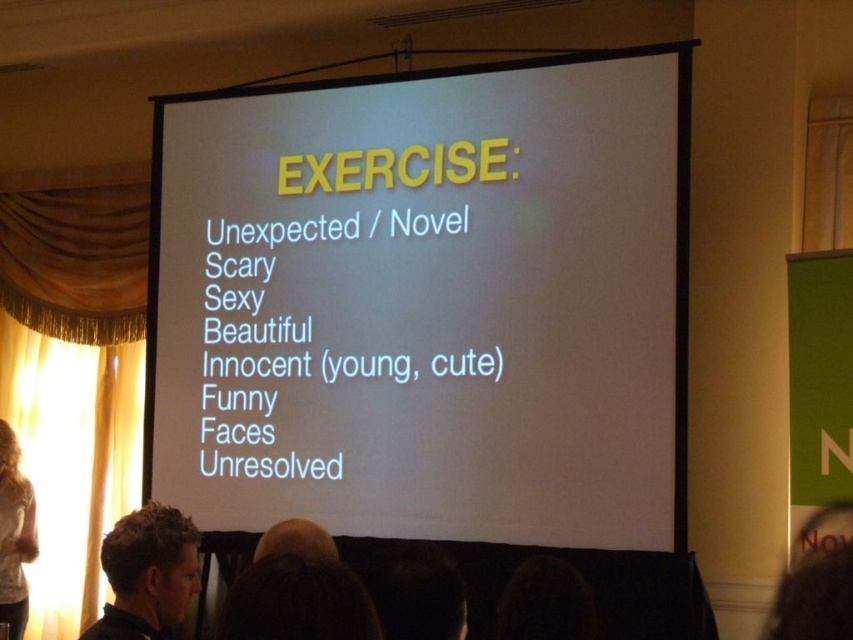
Question: Can you confirm if white matte projection screen at center is positioned above dark brown hair at lower left?

Choices:
 (A) yes
 (B) no

Answer: (A)

Question: Which point is farther to the camera?

Choices:
 (A) (137, 586)
 (B) (10, 515)
 (C) (286, 529)

Answer: (B)

Question: Which object appears farthest from the camera in this image?

Choices:
 (A) brown hair at center
 (B) light brown hair at left
 (C) white matte projection screen at center

Answer: (B)

Question: Which point is farther to the camera?

Choices:
 (A) (299, 500)
 (B) (320, 534)
 (C) (126, 582)

Answer: (A)

Question: Is light brown hair at left positioned before brown hair at center?

Choices:
 (A) yes
 (B) no

Answer: (B)

Question: Can you confirm if white matte projection screen at center is wider than light brown hair at left?

Choices:
 (A) no
 (B) yes

Answer: (B)